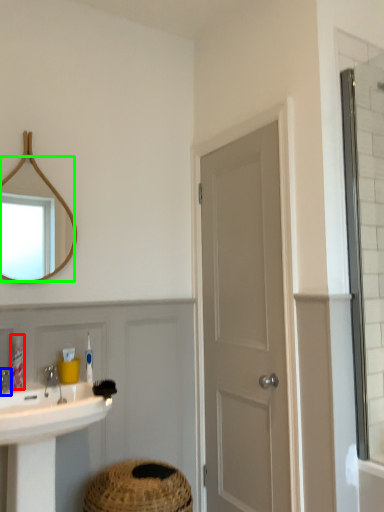
Question: Estimate the real-world distances between objects in this image. Which object is closer to toiletry (highlighted by a red box), tap (highlighted by a blue box) or mirror (highlighted by a green box)?

Choices:
 (A) tap
 (B) mirror

Answer: (A)